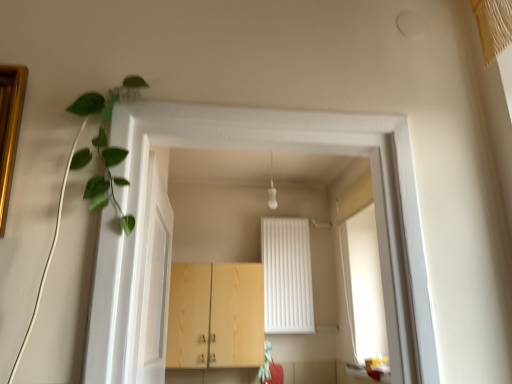
This screenshot has height=384, width=512. What are the coordinates of `white glossy door at left` in the screenshot? It's located at (154, 280).

Find the location of a particular element. The height and width of the screenshot is (384, 512). light wood cabinet at center is located at coordinates (216, 315).

What do you see at coordinates (108, 146) in the screenshot? Image resolution: width=512 pixels, height=384 pixels. I see `green leafy plant at upper left` at bounding box center [108, 146].

Identify the location of white glossy door at left. This screenshot has width=512, height=384. (154, 280).

Considering the relative sizes of light wood cabinet at center and white glossy door at left in the image provided, is light wood cabinet at center shorter than white glossy door at left?

No, light wood cabinet at center is not shorter than white glossy door at left.

Is the position of light wood cabinet at center more distant than that of white glossy door at left?

Yes, it is behind white glossy door at left.

Which object is positioned more to the left, light wood cabinet at center or white glossy door at left?

light wood cabinet at center.

Considering the positions of objects green leafy plant at upper left and white glossy door at left in the image provided, who is more to the right, green leafy plant at upper left or white glossy door at left?

white glossy door at left is more to the right.

In the scene shown: Which is nearer, (105,178) or (144,331)?

Point (105,178)

Is white glossy door at left at the back of green leafy plant at upper left?

Yes, green leafy plant at upper left is facing away from white glossy door at left.

From the image's perspective, does light wood cabinet at center appear higher than green leafy plant at upper left?

Incorrect, from the image's perspective, light wood cabinet at center is lower than green leafy plant at upper left.

Where is `cabinetry below the green leafy plant at upper left (from a real-world perspective)`? This screenshot has width=512, height=384. cabinetry below the green leafy plant at upper left (from a real-world perspective) is located at coordinates (216, 315).

Can you confirm if light wood cabinet at center is thinner than green leafy plant at upper left?

No, light wood cabinet at center is not thinner than green leafy plant at upper left.

Consider the image. Is light wood cabinet at center touching green leafy plant at upper left?

light wood cabinet at center is not next to green leafy plant at upper left, and they're not touching.

Are white glossy door at left and green leafy plant at upper left making contact?

They are not placed beside each other.

Can you confirm if white glossy door at left is thinner than green leafy plant at upper left?

No.

Based on the photo, are white glossy door at left and light wood cabinet at center located far from each other?

Yes, white glossy door at left is far from light wood cabinet at center.

From the image's perspective, is white glossy door at left located above or below light wood cabinet at center?

Based on their image positions, white glossy door at left is located above light wood cabinet at center.

Does white glossy door at left have a lesser width compared to light wood cabinet at center?

Indeed, white glossy door at left has a lesser width compared to light wood cabinet at center.

Considering the relative positions of white glossy door at left and light wood cabinet at center in the image provided, is white glossy door at left behind light wood cabinet at center?

No, white glossy door at left is closer to the viewer.

Is there a large distance between green leafy plant at upper left and light wood cabinet at center?

Absolutely, green leafy plant at upper left is distant from light wood cabinet at center.

Does green leafy plant at upper left have a smaller size compared to light wood cabinet at center?

Yes.

From the picture: From a real-world perspective, who is located higher, green leafy plant at upper left or light wood cabinet at center?

In real-world perspective, green leafy plant at upper left is above.

I want to click on cabinetry below the green leafy plant at upper left (from the image's perspective), so (216, 315).

Where is `cabinetry behind the white glossy door at left`? The width and height of the screenshot is (512, 384). cabinetry behind the white glossy door at left is located at coordinates (216, 315).

The width and height of the screenshot is (512, 384). I want to click on plant to the left of white glossy door at left, so click(x=108, y=146).

Looking at the image, which one is located further to green leafy plant at upper left, light wood cabinet at center or white glossy door at left?

light wood cabinet at center lies further to green leafy plant at upper left than the other object.

Based on their spatial positions, is light wood cabinet at center or green leafy plant at upper left further from white glossy door at left?

Based on the image, light wood cabinet at center appears to be further to white glossy door at left.

From the image, which object appears to be nearer to green leafy plant at upper left, white glossy door at left or light wood cabinet at center?

The object closer to green leafy plant at upper left is white glossy door at left.

When comparing their distances from light wood cabinet at center, does green leafy plant at upper left or white glossy door at left seem further?

green leafy plant at upper left is positioned further to the anchor light wood cabinet at center.

Based on their spatial positions, is green leafy plant at upper left or light wood cabinet at center further from white glossy door at left?

light wood cabinet at center is further to white glossy door at left.

When comparing their distances from light wood cabinet at center, does white glossy door at left or green leafy plant at upper left seem further?

The object further to light wood cabinet at center is green leafy plant at upper left.

Identify the location of door between green leafy plant at upper left and light wood cabinet at center from front to back. (154, 280).